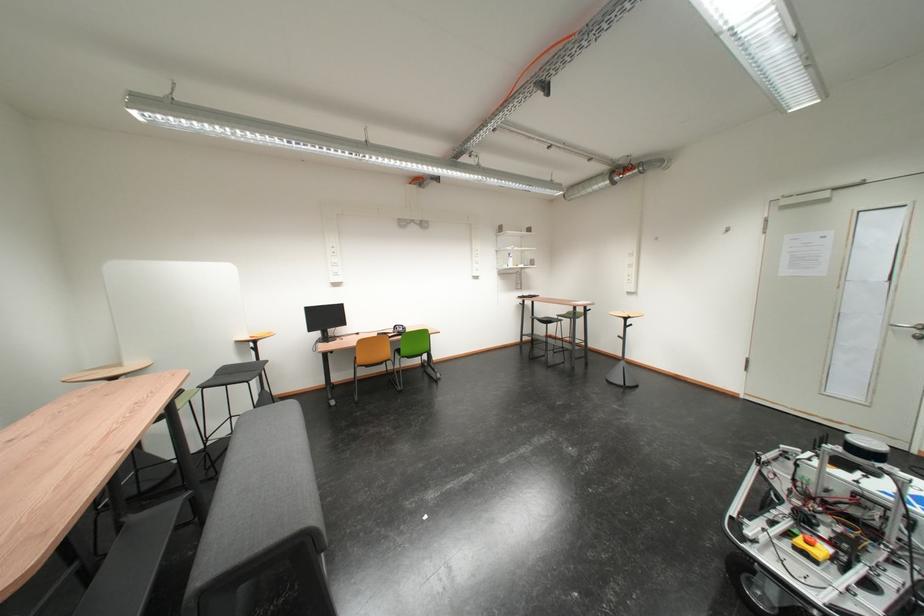
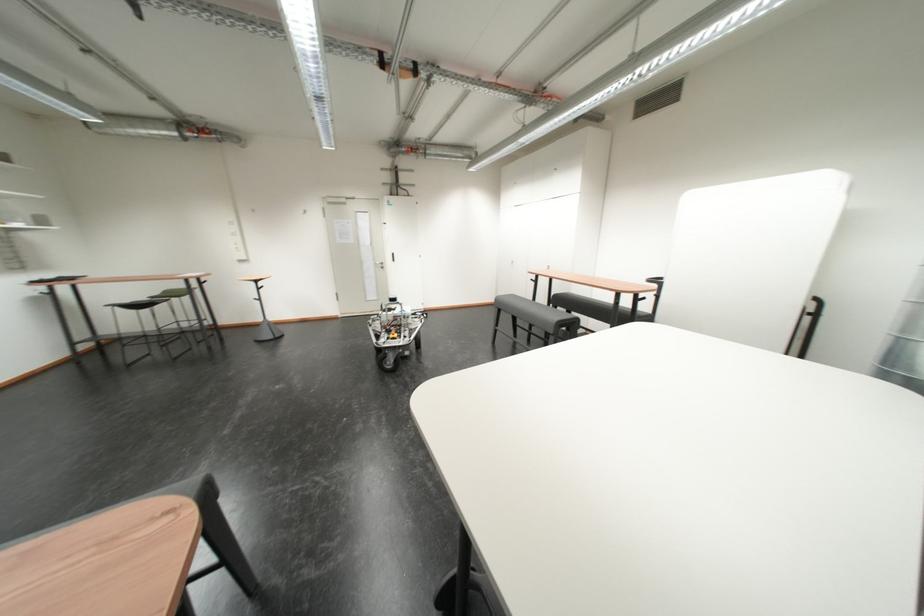
Where in the second image is the point corresponding to (568,318) from the first image?

(160, 300)